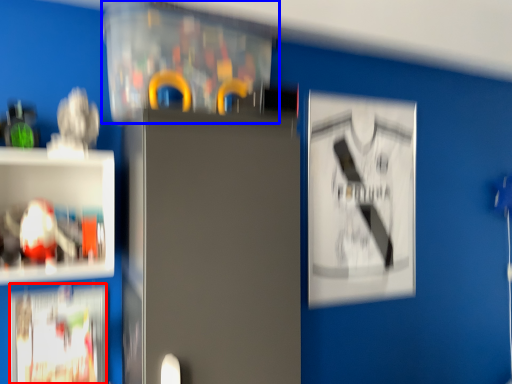
Question: Among these objects, which one is nearest to the camera, poster (highlighted by a red box) or cabinet (highlighted by a blue box)?

Choices:
 (A) poster
 (B) cabinet

Answer: (B)